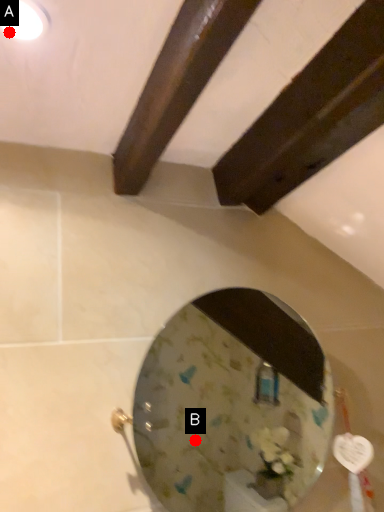
Question: Two points are circled on the image, labeled by A and B beside each circle. Which point is farther from the camera taking this photo?

Choices:
 (A) A is further
 (B) B is further

Answer: (B)